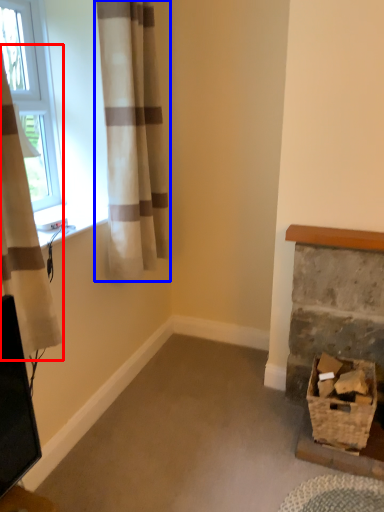
Question: Among these objects, which one is nearest to the camera, curtain (highlighted by a red box) or curtain (highlighted by a blue box)?

Choices:
 (A) curtain
 (B) curtain

Answer: (A)